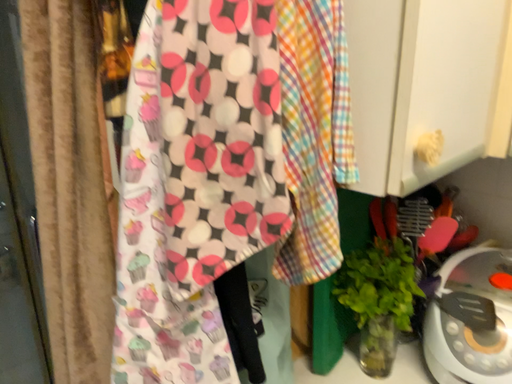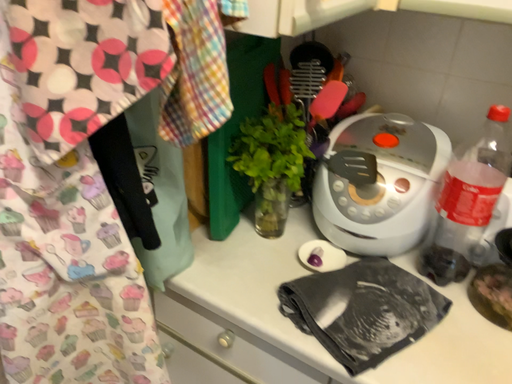
Question: Which way did the camera rotate in the video?

Choices:
 (A) rotated left
 (B) rotated right

Answer: (B)